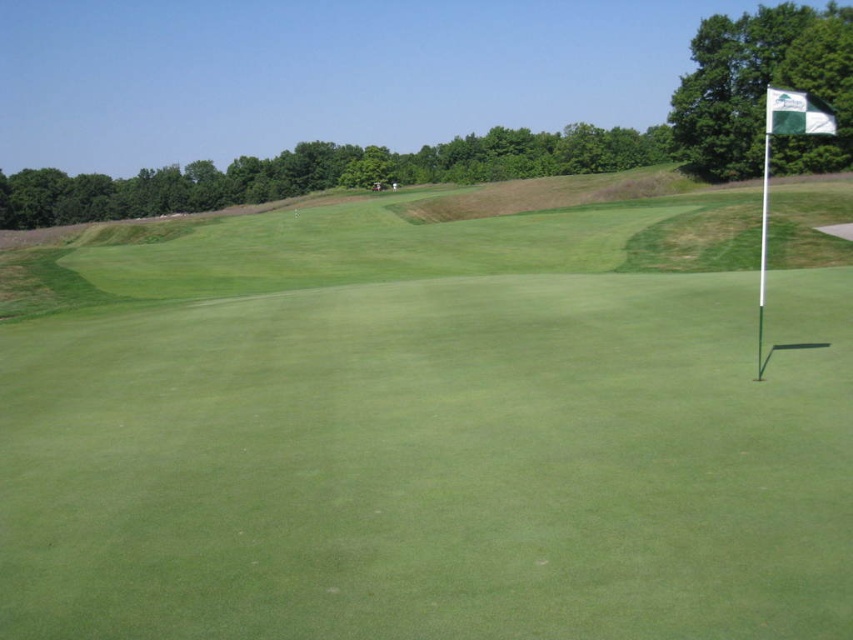
Does green grassy golf course at center have a larger size compared to green fabric flag at right?

Indeed, green grassy golf course at center has a larger size compared to green fabric flag at right.

In the scene shown: Is green grassy golf course at center above green fabric flag at right?

Actually, green grassy golf course at center is below green fabric flag at right.

Is point (552, 330) positioned behind point (793, 102)?

Yes.

The width and height of the screenshot is (853, 640). What are the coordinates of `green grassy golf course at center` in the screenshot? It's located at (x=425, y=429).